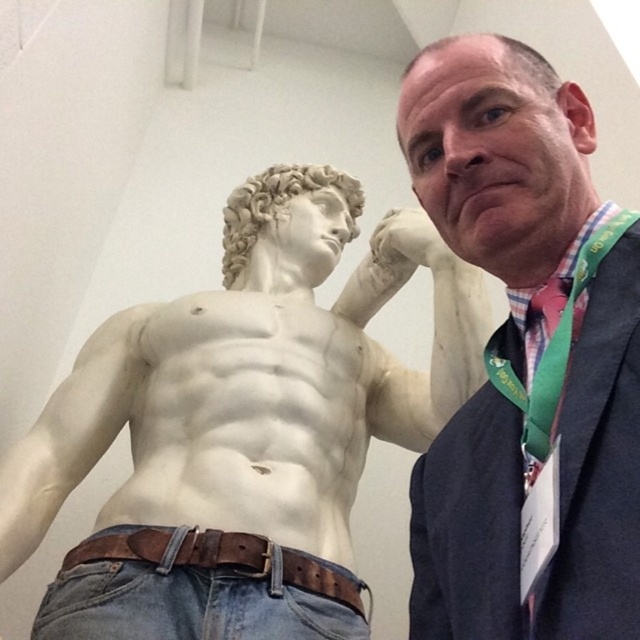
Does point (282, 561) lie in front of point (621, 372)?

No.

Is white marble statue at center below matte white statue at upper left?

Indeed, white marble statue at center is positioned under matte white statue at upper left.

Measure the distance between point (433, 417) and camera.

Point (433, 417) is 10.48 feet away from camera.

The image size is (640, 640). I want to click on white marble statue at center, so coord(246,413).

Does white marble statue at center have a smaller size compared to matte pink fabric tie at right?

Actually, white marble statue at center might be larger than matte pink fabric tie at right.

Does white marble statue at center have a larger size compared to matte pink fabric tie at right?

Correct, white marble statue at center is larger in size than matte pink fabric tie at right.

Between point (250, 284) and point (547, 307), which one is positioned in front?

Point (547, 307) is more forward.

I want to click on white marble statue at center, so click(x=246, y=413).

Between brown leather belt at lower center and matte pink fabric tie at right, which one appears on the right side from the viewer's perspective?

matte pink fabric tie at right

Is point (72, 557) less distant than point (570, 305)?

No, (72, 557) is behind (570, 305).

The image size is (640, 640). What are the coordinates of `brown leather belt at lower center` in the screenshot? It's located at (224, 560).